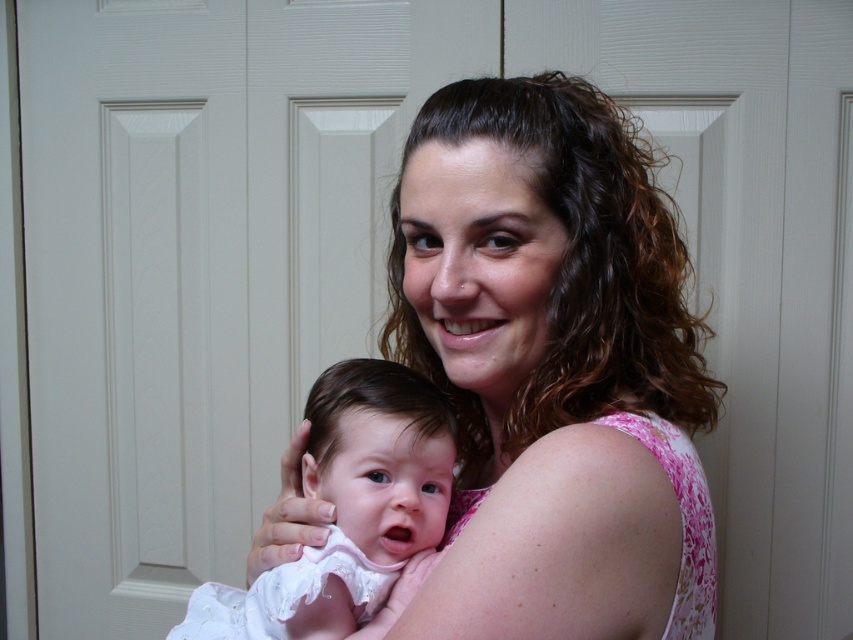
Question: Is pink floral dress at center below white soft fabric baby at center?

Choices:
 (A) no
 (B) yes

Answer: (A)

Question: Observing the image, what is the correct spatial positioning of pink floral dress at center in reference to white soft fabric baby at center?

Choices:
 (A) right
 (B) left

Answer: (A)

Question: Is pink floral dress at center closer to the viewer compared to white soft fabric baby at center?

Choices:
 (A) yes
 (B) no

Answer: (A)

Question: Which of the following is the farthest from the observer?

Choices:
 (A) (315, 440)
 (B) (686, 579)

Answer: (A)

Question: Among these objects, which one is nearest to the camera?

Choices:
 (A) pink floral dress at center
 (B) white soft fabric baby at center

Answer: (A)